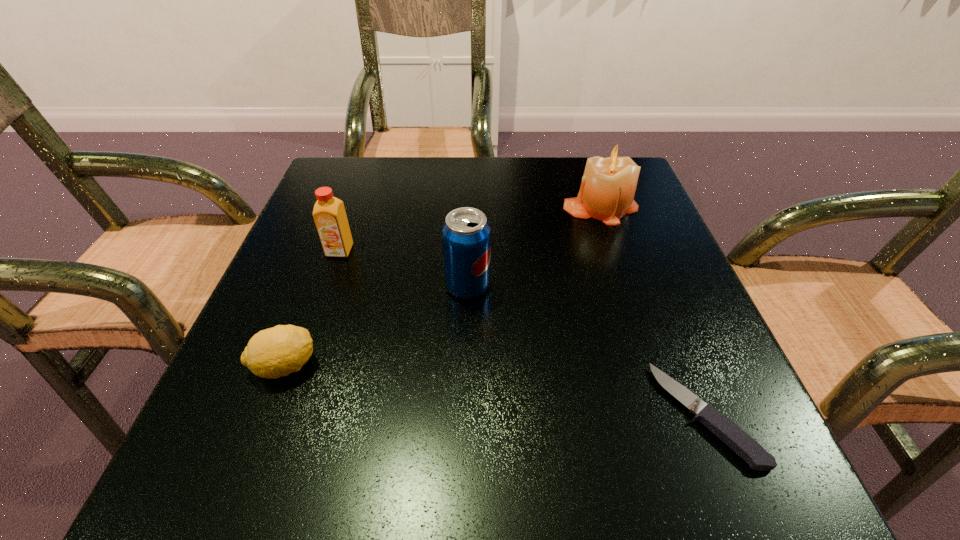
At what (x,y) coordinates should I click in order to perform the action: click on vacant space at the near edge. Please return your answer as a coordinate pair (x, y). Looking at the image, I should click on (599, 482).

The width and height of the screenshot is (960, 540). Identify the location of blank space at the left edge of the desktop. (340, 260).

In the image, there is a desktop. Identify the location of free space at the right edge. (689, 382).

Locate an element on the screen. The image size is (960, 540). free location at the far left corner of the desktop is located at coordinates (357, 205).

The image size is (960, 540). I want to click on blank space at the near left corner of the desktop, so [251, 456].

The width and height of the screenshot is (960, 540). In order to click on unoccupied area between the orange juice and the third object from right to left in this screenshot , I will do `click(404, 268)`.

The image size is (960, 540). I want to click on empty space between the second shortest object and the pop soda, so click(376, 326).

This screenshot has height=540, width=960. In order to click on empty location between the fourth tallest object and the candle in this screenshot , I will do `click(443, 286)`.

Identify the location of free space between the farthest object and the shortest object. (653, 310).

At what (x,y) coordinates should I click in order to perform the action: click on vacant space that is in between the pop soda and the second shortest object. Please return your answer as a coordinate pair (x, y). Looking at the image, I should click on (376, 326).